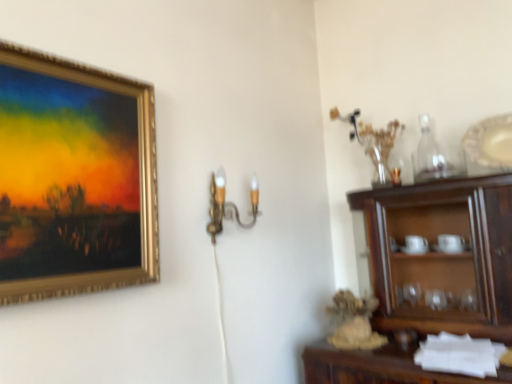
Question: Is gold metallic picture frame at upper left facing away from gold metallic wall sconce at center?

Choices:
 (A) yes
 (B) no

Answer: (B)

Question: Are gold metallic picture frame at upper left and gold metallic wall sconce at center beside each other?

Choices:
 (A) no
 (B) yes

Answer: (A)

Question: From the image's perspective, does gold metallic picture frame at upper left appear lower than gold metallic wall sconce at center?

Choices:
 (A) no
 (B) yes

Answer: (A)

Question: Is gold metallic picture frame at upper left shorter than gold metallic wall sconce at center?

Choices:
 (A) yes
 (B) no

Answer: (B)

Question: Considering the relative positions of gold metallic picture frame at upper left and gold metallic wall sconce at center in the image provided, is gold metallic picture frame at upper left to the left of gold metallic wall sconce at center from the viewer's perspective?

Choices:
 (A) yes
 (B) no

Answer: (A)

Question: Considering the relative positions of gold metallic wall sconce at center and clear glass bottle at upper right in the image provided, is gold metallic wall sconce at center to the left or to the right of clear glass bottle at upper right?

Choices:
 (A) left
 (B) right

Answer: (A)

Question: From the image's perspective, relative to clear glass bottle at upper right, is gold metallic wall sconce at center above or below?

Choices:
 (A) above
 (B) below

Answer: (B)

Question: From their relative heights in the image, would you say gold metallic wall sconce at center is taller or shorter than clear glass bottle at upper right?

Choices:
 (A) short
 (B) tall

Answer: (A)

Question: In terms of width, does gold metallic wall sconce at center look wider or thinner when compared to clear glass bottle at upper right?

Choices:
 (A) thin
 (B) wide

Answer: (B)

Question: Does point (450, 327) appear closer or farther from the camera than point (83, 241)?

Choices:
 (A) closer
 (B) farther

Answer: (B)

Question: From their relative heights in the image, would you say dark wood cabinet at right is taller or shorter than gold metallic picture frame at upper left?

Choices:
 (A) short
 (B) tall

Answer: (A)

Question: Considering their positions, is dark wood cabinet at right located in front of or behind gold metallic picture frame at upper left?

Choices:
 (A) front
 (B) behind

Answer: (B)

Question: Considering the positions of dark wood cabinet at right and gold metallic picture frame at upper left in the image, is dark wood cabinet at right bigger or smaller than gold metallic picture frame at upper left?

Choices:
 (A) small
 (B) big

Answer: (B)

Question: From the image's perspective, is gold metallic picture frame at upper left located above or below gold metallic wall sconce at center?

Choices:
 (A) below
 (B) above

Answer: (B)

Question: Is gold metallic picture frame at upper left to the left or to the right of gold metallic wall sconce at center in the image?

Choices:
 (A) left
 (B) right

Answer: (A)